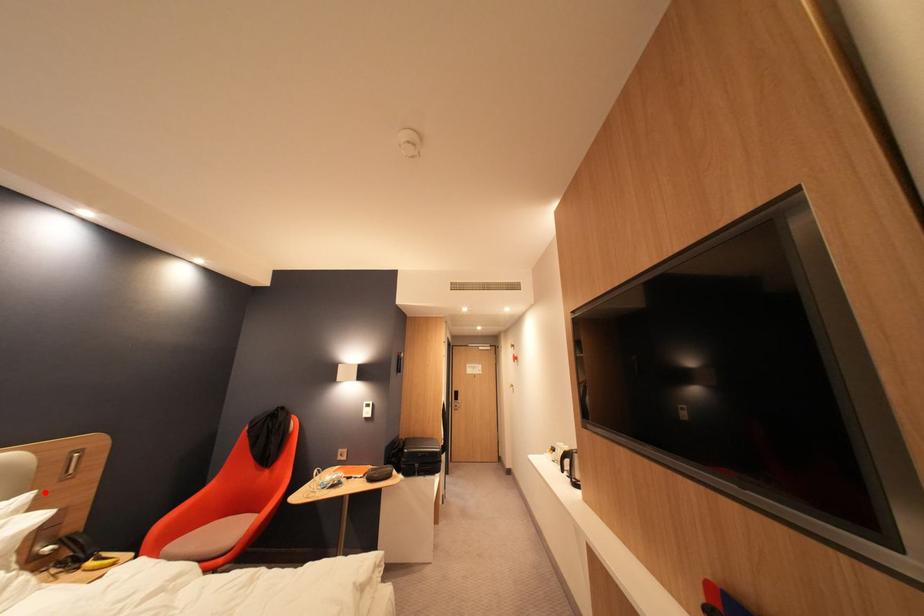
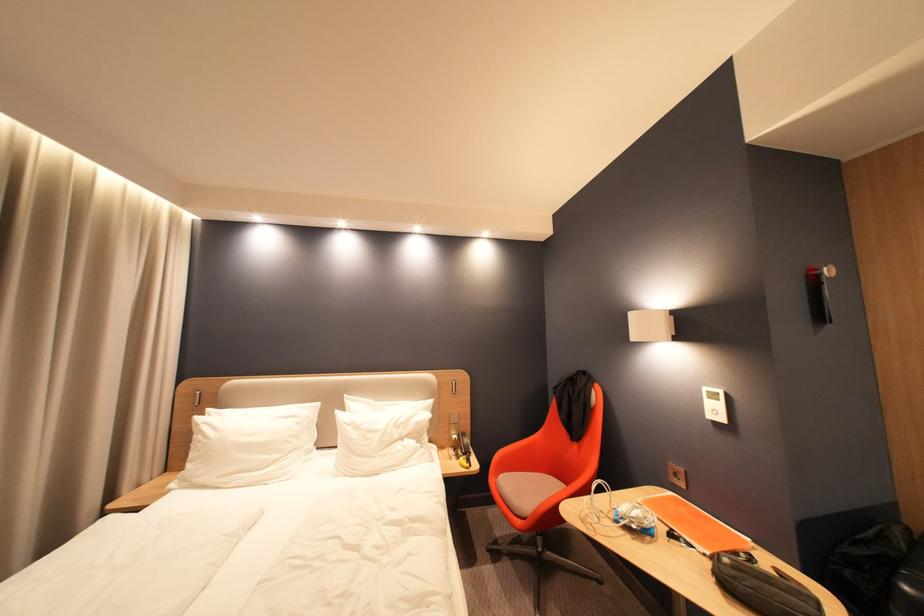
Find the pixel in the second image that matches the highlighted location in the first image.

(443, 400)